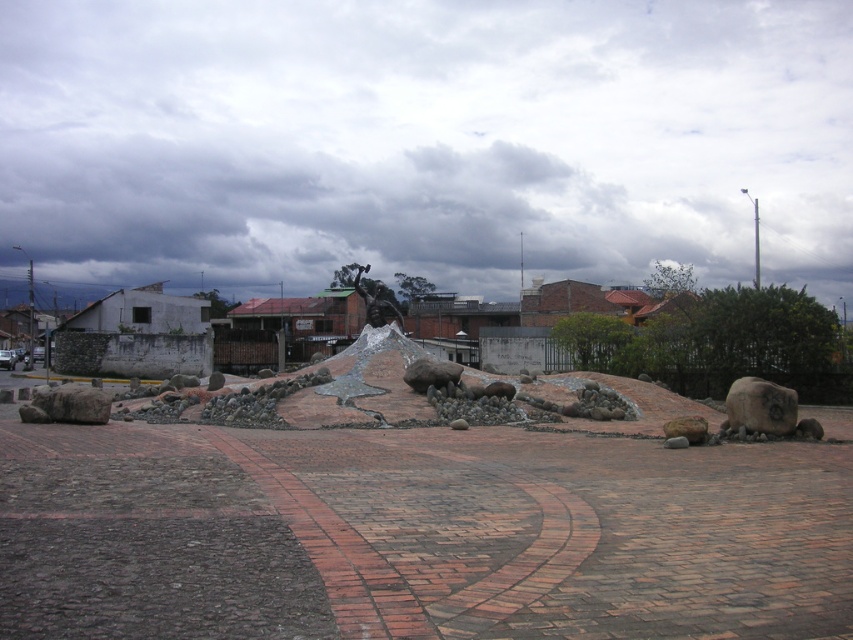
Can you confirm if smooth gray rock at right is positioned to the right of shiny bronze statue at center?

Yes, smooth gray rock at right is to the right of shiny bronze statue at center.

Measure the distance between smooth gray rock at right and camera.

smooth gray rock at right is 14.49 meters away from camera.

Locate an element on the screen. The width and height of the screenshot is (853, 640). smooth gray rock at right is located at coordinates (761, 406).

Locate an element on the screen. smooth gray rock at right is located at coordinates (761, 406).